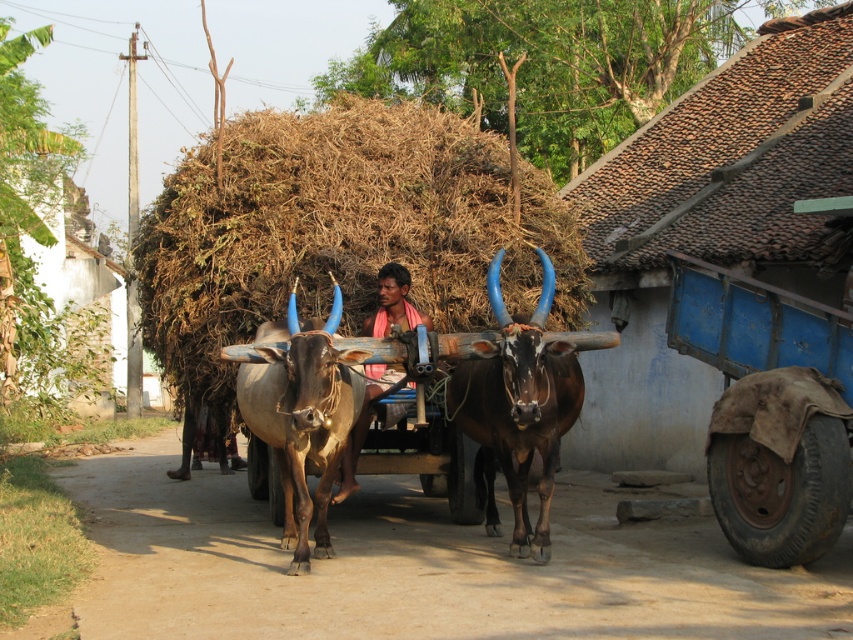
Which of these two, shiny brown bull at center or brown glossy bull at center, stands shorter?

With less height is brown glossy bull at center.

Can you confirm if shiny brown bull at center is positioned to the right of brown glossy bull at center?

Correct, you'll find shiny brown bull at center to the right of brown glossy bull at center.

Is point (482, 496) less distant than point (318, 547)?

No, it is not.

The width and height of the screenshot is (853, 640). Identify the location of shiny brown bull at center. (517, 410).

Is point (531, 435) more distant than point (402, 282)?

That is False.

Is point (486, 529) farther from camera compared to point (404, 307)?

Yes.

The image size is (853, 640). Find the location of `shiny brown bull at center`. shiny brown bull at center is located at coordinates (517, 410).

Does brown/dry grass at center have a smaller size compared to shiny brown bull at center?

Yes.

Does brown/dry grass at center appear under shiny brown bull at center?

Actually, brown/dry grass at center is above shiny brown bull at center.

Is point (238, 278) positioned before point (538, 528)?

That is False.

Image resolution: width=853 pixels, height=640 pixels. I want to click on brown/dry grass at center, so click(340, 230).